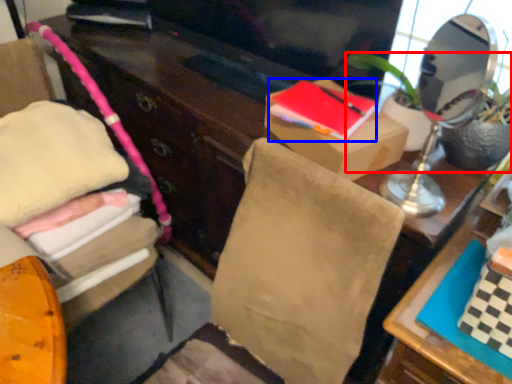
Question: Which object appears farthest to the camera in this image, houseplant (highlighted by a red box) or book (highlighted by a blue box)?

Choices:
 (A) houseplant
 (B) book

Answer: (B)